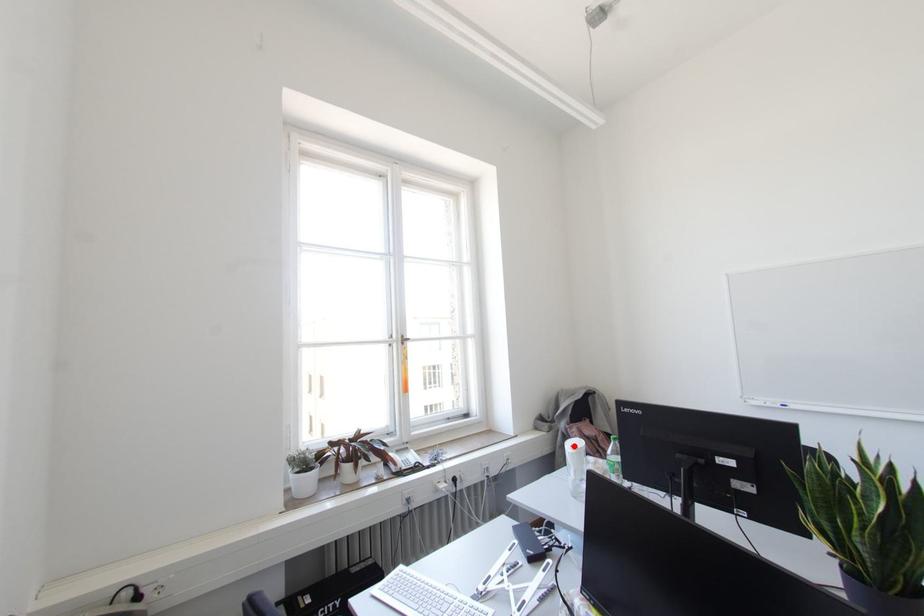
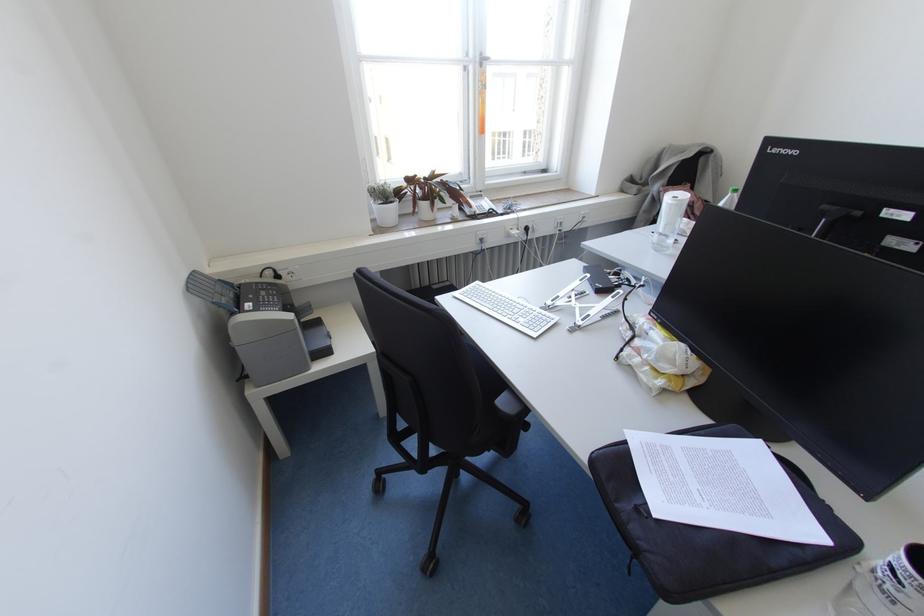
The point at the highlighted location is marked in the first image. Where is the corresponding point in the second image?

(676, 197)